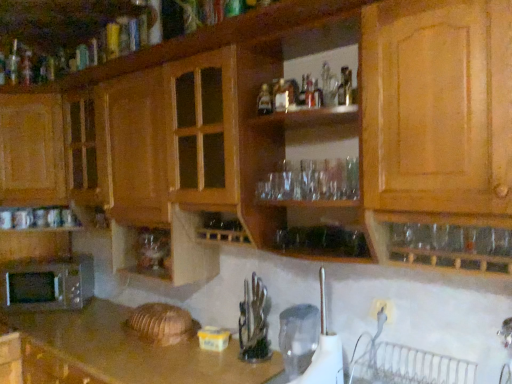
In order to click on vacant area that is in front of silver metallic microwave at lower left in this screenshot , I will do `click(38, 322)`.